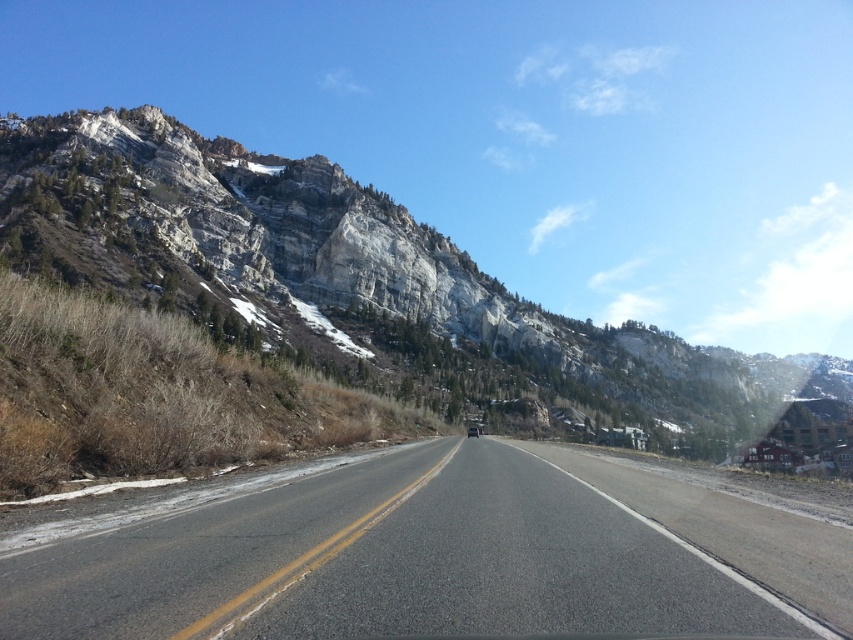
Identify the location of asphalt road at center. (432, 556).

Between asphalt road at center and rocky cliff at upper left, which one is positioned higher?

rocky cliff at upper left is above.

Which is in front, point (701, 556) or point (6, 140)?

Point (701, 556) is in front.

I want to click on asphalt road at center, so click(x=432, y=556).